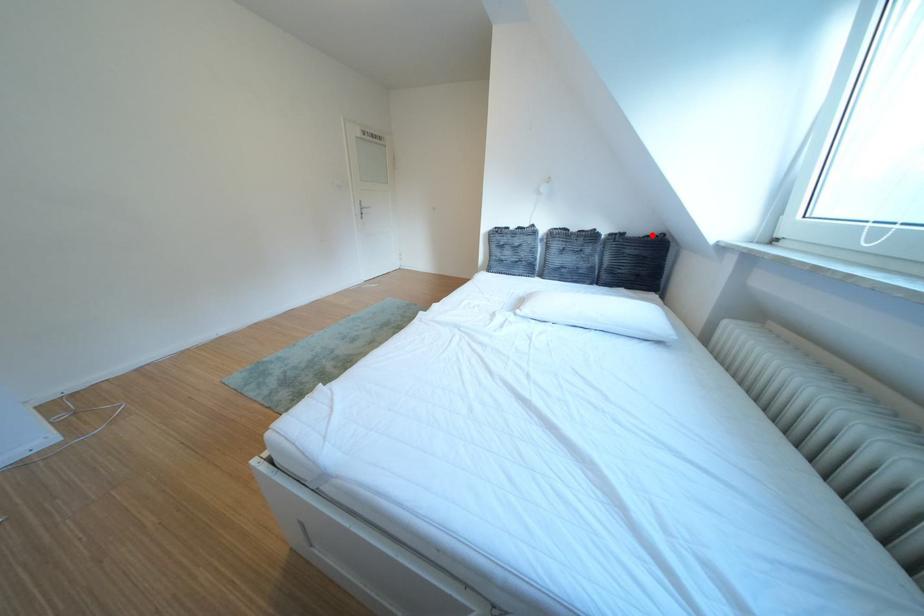
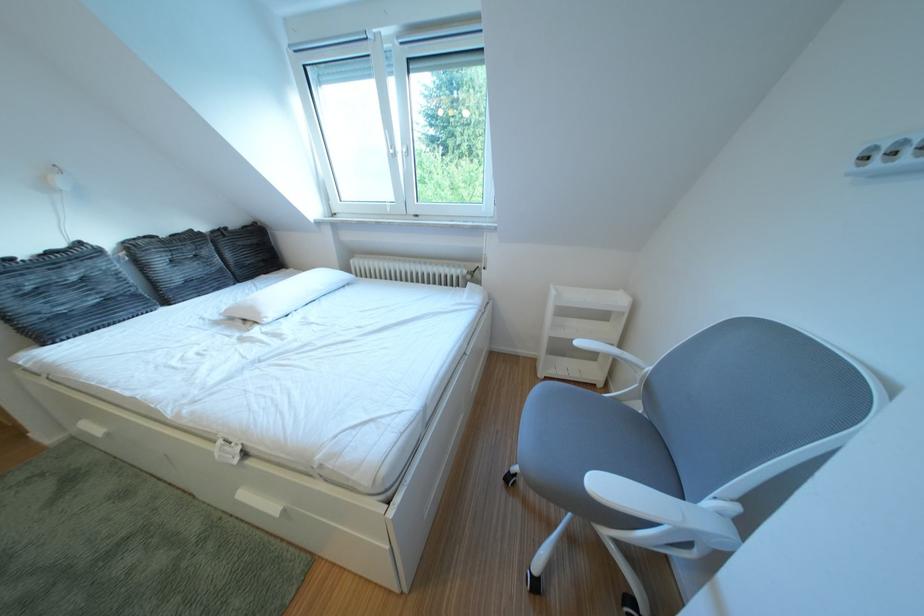
Question: I am providing you with two images of the same scene from different viewpoints. In image1, a red point is highlighted. Considering the same 3D point in image2, which of the following is correct?

Choices:
 (A) It is closer
 (B) It is farther

Answer: (A)